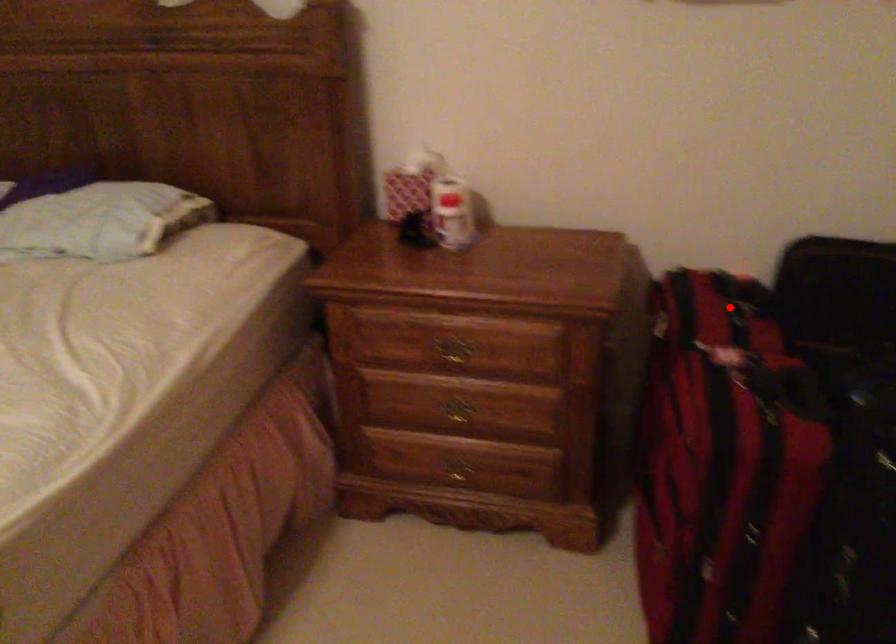
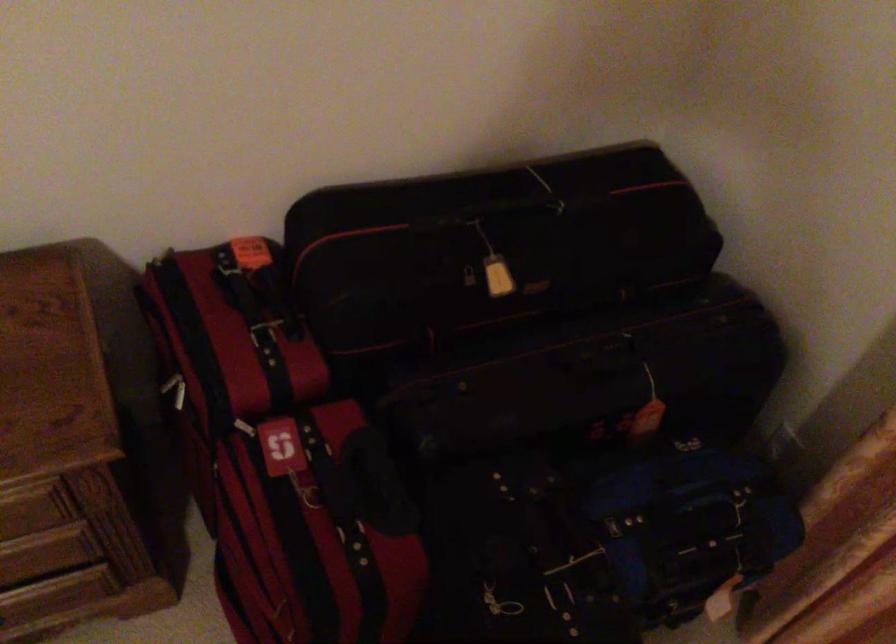
Where in the second image is the point corresponding to the highlighted location from the first image?

(264, 334)